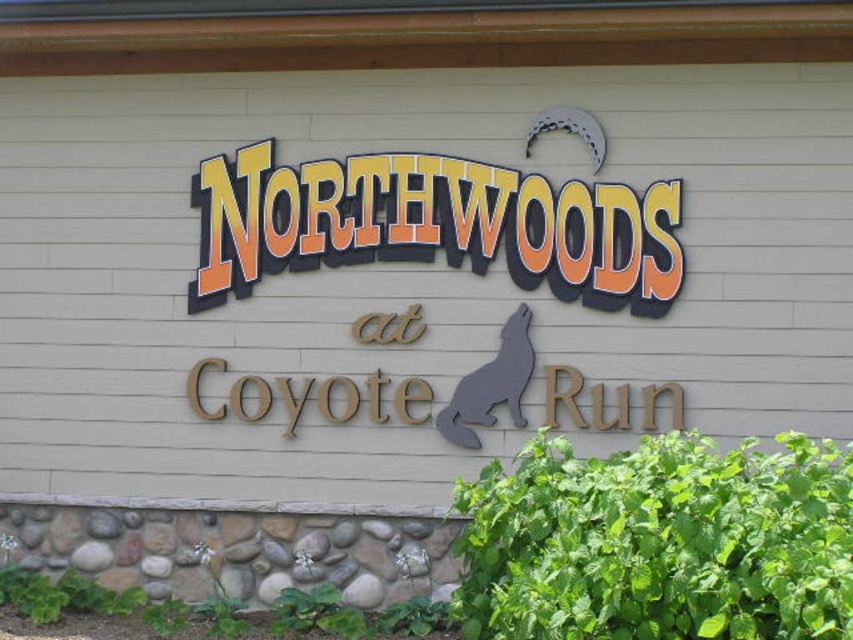
Who is lower down, orange brick sign at center or wooden coyote at center?

wooden coyote at center

I want to click on orange brick sign at center, so click(x=434, y=225).

The height and width of the screenshot is (640, 853). I want to click on orange brick sign at center, so click(434, 225).